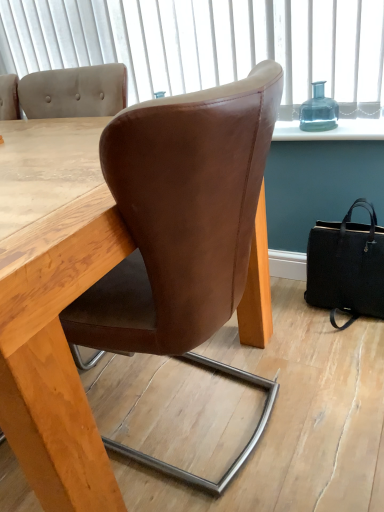
Question: From the image's perspective, is black leather handbag at lower right above or below brown leather chair at center?

Choices:
 (A) above
 (B) below

Answer: (A)

Question: In terms of width, does black leather handbag at lower right look wider or thinner when compared to brown leather chair at center?

Choices:
 (A) thin
 (B) wide

Answer: (A)

Question: Considering the real-world distances, which object is farthest from the transparent glass bottle at upper right?

Choices:
 (A) black leather handbag at lower right
 (B) brown leather chair at center

Answer: (B)

Question: Which object is positioned closest to the transparent glass bottle at upper right?

Choices:
 (A) brown leather chair at center
 (B) black leather handbag at lower right

Answer: (B)